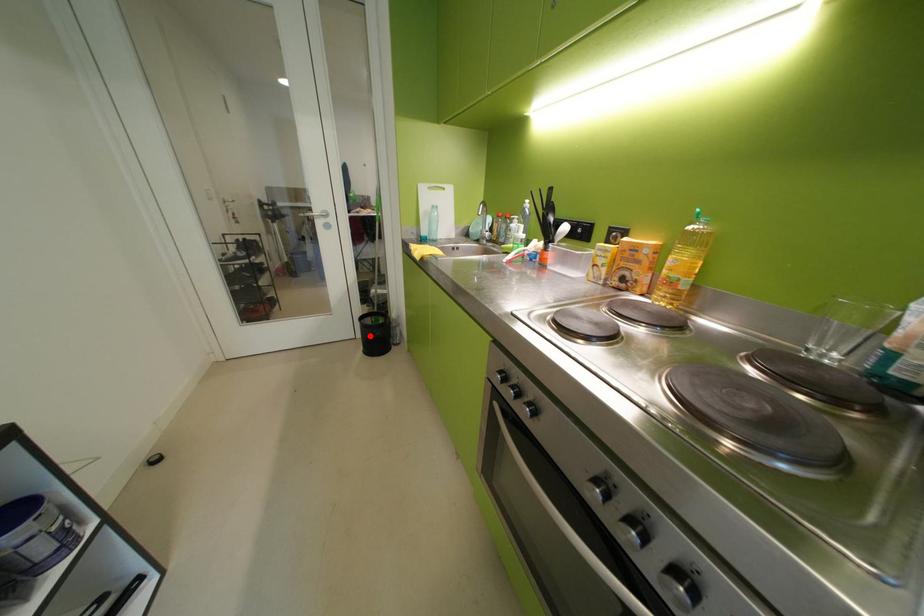
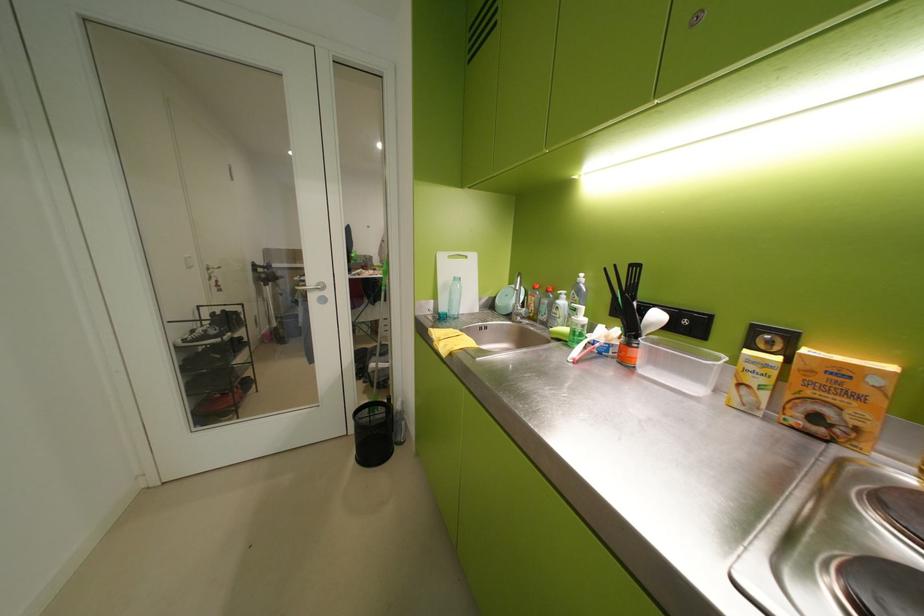
The point at the highlighted location is marked in the first image. Where is the corresponding point in the second image?

(363, 432)